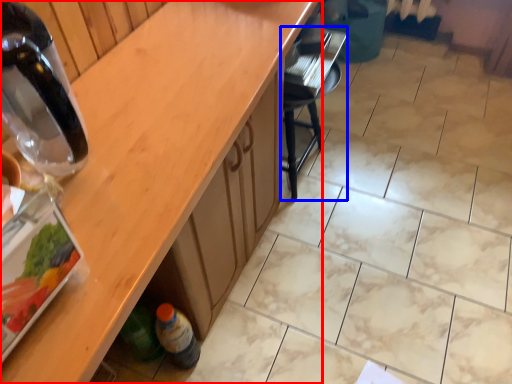
Question: Which object is closer to the camera taking this photo, countertop (highlighted by a red box) or chair (highlighted by a blue box)?

Choices:
 (A) countertop
 (B) chair

Answer: (A)